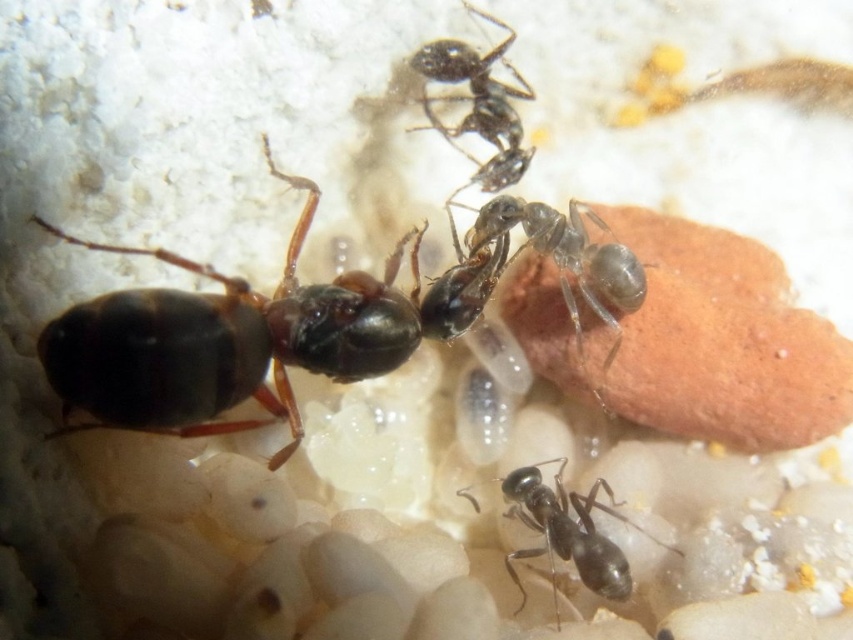
You are a photographer holding a camera 1.2 meters tall. You want to take a photo of the black glossy ant at center. Can you focus on the ant without bending down?

The black glossy ant at center and camera are 1.18 meters apart from each other. Since the camera is 1.2 meters tall, you can focus on the ant without bending down as the distance is slightly less than the camera height.

You are a tiny insect explorer who needs to travel from the black glossy ant at center to the black glossy ant at upper center. Given that your maximum travel distance is 20 inches, can you safely make this journey without exceeding your limit?

The black glossy ant at center and black glossy ant at upper center are 19.77 inches apart from each other. Since your maximum travel distance is 20 inches, you can safely make this journey without exceeding your limit.

You are a researcher holding a magnifying glass and observing the shiny black ant at upper left. You want to get a closer look without disturbing it. If you move your magnifying glass 10 inches closer to the ant, will it still be in focus?

The shiny black ant at upper left is currently 35.67 inches from the viewer. Moving the magnifying glass 10 inches closer would bring it to 25.67 inches away. Since magnifying glasses typically have a focal length of around 10 inches, the ant would now be within the optimal focus range. Therefore, moving the magnifying glass closer would allow for a clearer view.